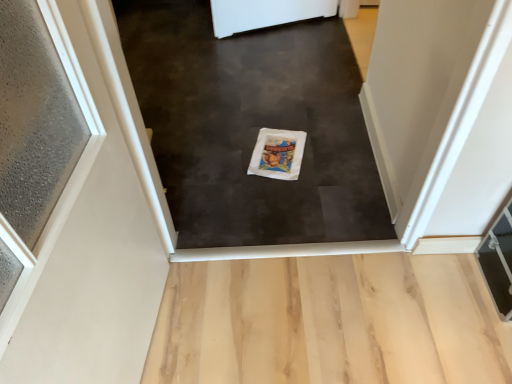
What do you see at coordinates (69, 210) in the screenshot? I see `white textured door at left` at bounding box center [69, 210].

Where is `white textured door at left`? The width and height of the screenshot is (512, 384). white textured door at left is located at coordinates (69, 210).

The width and height of the screenshot is (512, 384). What do you see at coordinates (253, 126) in the screenshot?
I see `white fabric bag at center` at bounding box center [253, 126].

Where is `white fabric bag at center`? The width and height of the screenshot is (512, 384). white fabric bag at center is located at coordinates 253,126.

Image resolution: width=512 pixels, height=384 pixels. Find the location of `white textured door at left`. white textured door at left is located at coordinates (69, 210).

Which is more to the left, white textured door at left or white fabric bag at center?

white textured door at left is more to the left.

Relative to white fabric bag at center, is white textured door at left in front or behind?

Clearly, white textured door at left is in front of white fabric bag at center.

Is point (138, 265) positioned before point (343, 224)?

Yes, it is.

From the image's perspective, is white textured door at left below white fabric bag at center?

Indeed, from the image's perspective, white textured door at left is shown beneath white fabric bag at center.

From a real-world perspective, relative to white fabric bag at center, is white textured door at left vertically above or below?

In terms of real-world spatial position, white textured door at left is below white fabric bag at center.

Which of these two, white textured door at left or white fabric bag at center, is thinner?

white fabric bag at center is thinner.

Can you confirm if white textured door at left is shorter than white fabric bag at center?

Correct, white textured door at left is not as tall as white fabric bag at center.

Which of these two, white textured door at left or white fabric bag at center, is smaller?

Smaller between the two is white fabric bag at center.

Would you say white textured door at left contains white fabric bag at center?

Definitely not — white fabric bag at center is not inside white textured door at left.

Can you see white textured door at left touching white fabric bag at center?

They are not placed beside each other.

Is white fabric bag at center at the back of white textured door at left?

That's not correct — white textured door at left is not looking away from white fabric bag at center.

Identify the location of mat on the right of white textured door at left. This screenshot has width=512, height=384. (253, 126).

Can you confirm if white fabric bag at center is positioned to the right of white textured door at left?

Correct, you'll find white fabric bag at center to the right of white textured door at left.

Is white fabric bag at center positioned in front of white textured door at left?

No.

Is point (150, 117) positioned before point (37, 168)?

No, it is not.

From the image's perspective, is white fabric bag at center above or below white textured door at left?

white fabric bag at center is above white textured door at left.

From a real-world perspective, relative to white textured door at left, is white fabric bag at center vertically above or below?

white fabric bag at center is situated higher than white textured door at left in the real world.

Considering the sizes of objects white fabric bag at center and white textured door at left in the image provided, who is wider, white fabric bag at center or white textured door at left?

white textured door at left.

Is white fabric bag at center taller than white textured door at left?

Yes, white fabric bag at center is taller than white textured door at left.

Looking at this image, who is smaller, white fabric bag at center or white textured door at left?

Smaller between the two is white fabric bag at center.

Is white fabric bag at center outside of white textured door at left?

Indeed, white fabric bag at center is completely outside white textured door at left.

Is white fabric bag at center far from white textured door at left?

No, there isn't a large distance between white fabric bag at center and white textured door at left.

Is white fabric bag at center facing towards white textured door at left?

No, white fabric bag at center is not turned towards white textured door at left.

What's the angular difference between white fabric bag at center and white textured door at left's facing directions?

The facing directions of white fabric bag at center and white textured door at left are 0.297 degrees apart.

Find the location of `door below the white fabric bag at center (from a real-world perspective)`. door below the white fabric bag at center (from a real-world perspective) is located at coordinates (69, 210).

The height and width of the screenshot is (384, 512). Find the location of `mat behind the white textured door at left`. mat behind the white textured door at left is located at coordinates (253, 126).

Identify the location of door in front of the white fabric bag at center. The width and height of the screenshot is (512, 384). (69, 210).